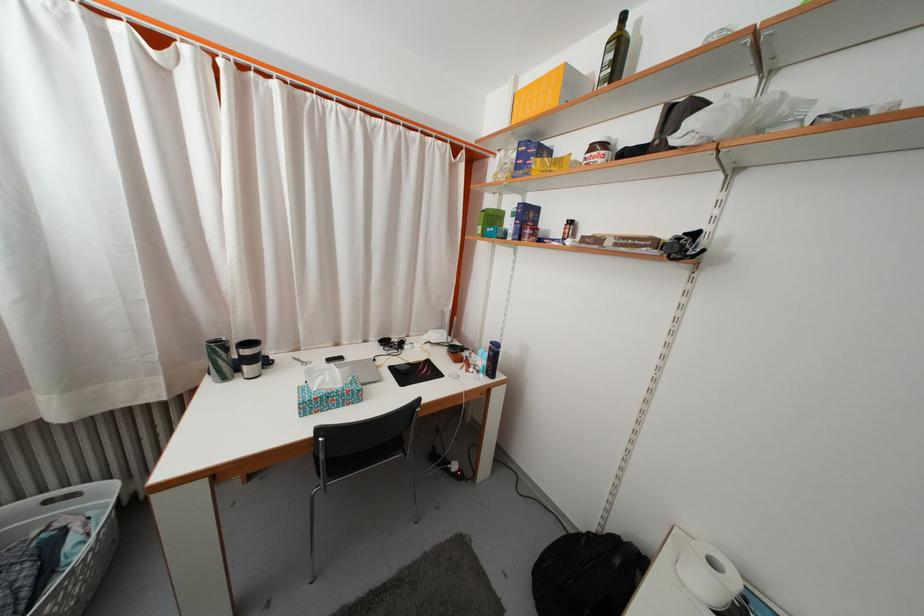
Locate an element on the screen. The image size is (924, 616). blue spray can is located at coordinates (492, 359).